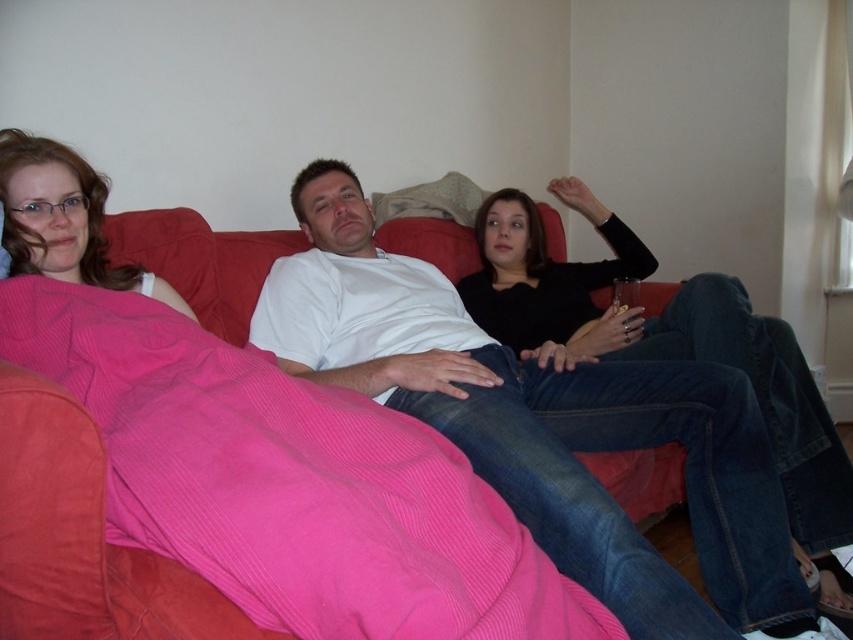
From the picture: You are taking a photo of the scene and want to focus on both the point at coordinates point (422, 449) and point (300, 317). Which point should you adjust your focus to first to ensure both are in sharp view?

Point (422, 449) is closer to the camera than point (300, 317). To ensure both are in sharp view, focus on the closer point first, then adjust slightly for the farther one.

You are a photographer setting up a shoot in this living room. You need to place a 1.2m tall tripod between the pink corduroy blanket at upper left and the white cotton shirt at center. Will the tripod fit vertically between them?

The pink corduroy blanket at upper left is not as tall as the white cotton shirt at center, so the vertical space between them may vary. However, since the objects are at different positions, the exact height available isn

Looking at this image, you are a delivery robot that needs to place a small package on the couch between the pink corduroy blanket at upper left and the white cotton shirt at center. The package is 12 inches long. Can you fit it there without overlapping either item?

The distance between the pink corduroy blanket at upper left and the white cotton shirt at center is 14.51 inches. Since the package is 12 inches long, there is enough space to place it between them without overlapping either item.